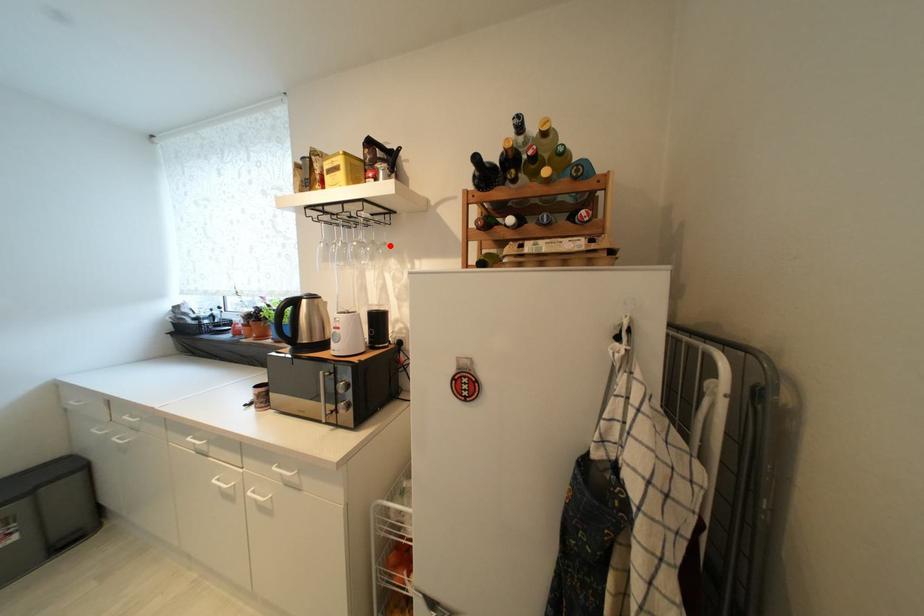
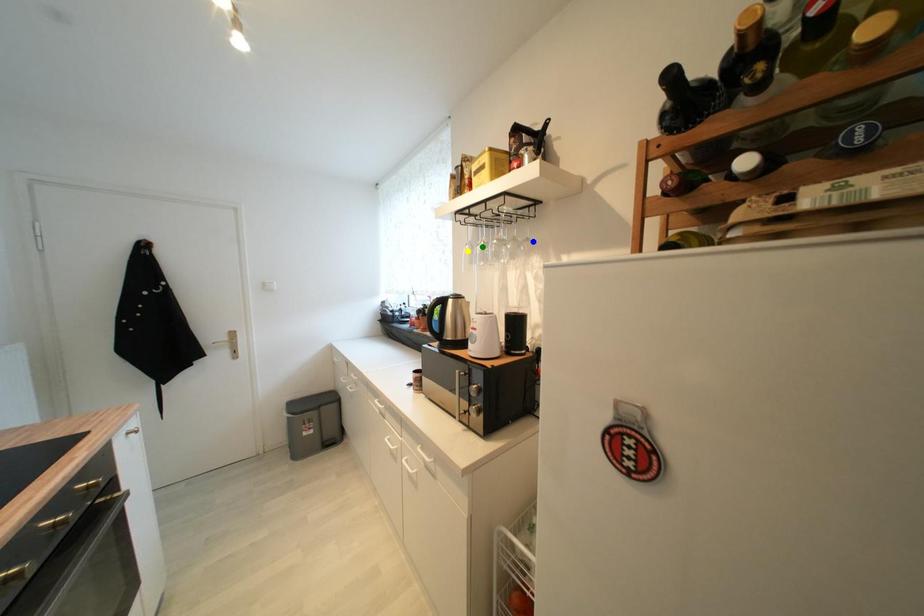
Question: I am providing you with two images of the same scene from different viewpoints. A red point is marked on the first image. You are given multiple points on the second image. Can you choose the point in image 2 that corresponds to the point in image 1?

Choices:
 (A) yellow point
 (B) blue point
 (C) green point

Answer: (B)